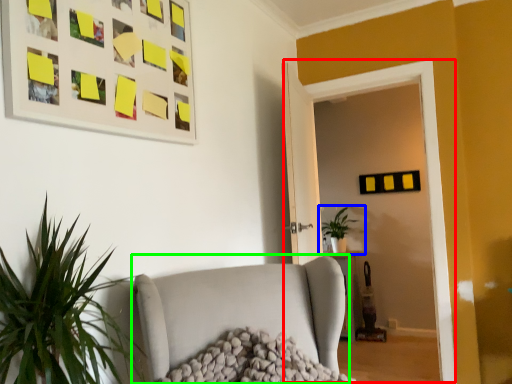
Question: Which is nearer to the glass door (highlighted by a red box)? houseplant (highlighted by a blue box) or studio couch (highlighted by a green box).

Choices:
 (A) houseplant
 (B) studio couch

Answer: (B)